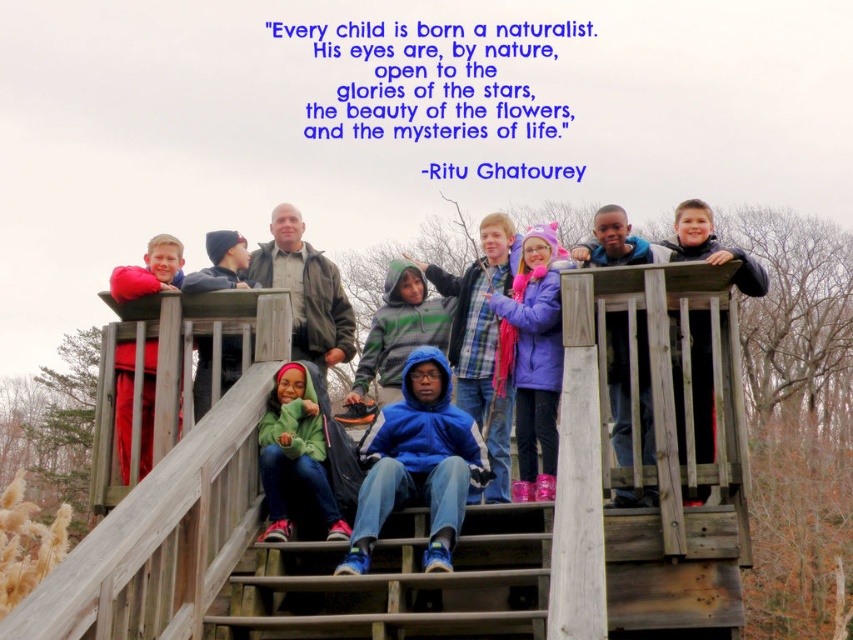
Question: Can you confirm if wooden staircase at center is positioned below purple fleece jacket at upper center?

Choices:
 (A) yes
 (B) no

Answer: (A)

Question: Which of the following is the closest to the observer?

Choices:
 (A) purple fleece jacket at upper center
 (B) matte red jacket at upper left
 (C) wooden staircase at center
 (D) wooden stairs at center

Answer: (C)

Question: Is wooden stairs at center positioned behind blue fleece hoodie at center?

Choices:
 (A) no
 (B) yes

Answer: (B)

Question: Among these points, which one is nearest to the camera?

Choices:
 (A) (305, 422)
 (B) (146, 426)
 (C) (544, 394)
 (D) (421, 385)

Answer: (A)

Question: Which of the following is the closest to the observer?

Choices:
 (A) (432, 422)
 (B) (552, 349)
 (C) (347, 536)
 (D) (119, 460)

Answer: (C)

Question: Can you confirm if blue fleece hoodie at center is positioned below green fleece jacket at center?

Choices:
 (A) no
 (B) yes

Answer: (B)